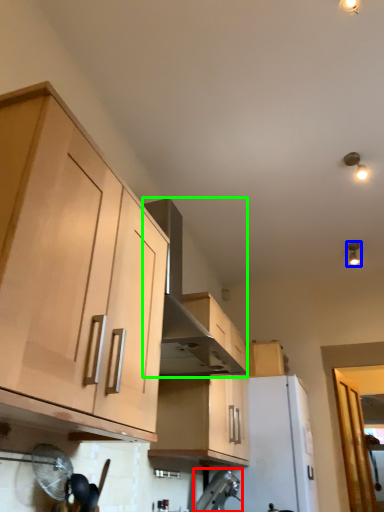
Question: Which object is positioned farthest from appliance (highlighted by a red box)? Select from light fixture (highlighted by a blue box) and vent (highlighted by a green box).

Choices:
 (A) light fixture
 (B) vent

Answer: (A)